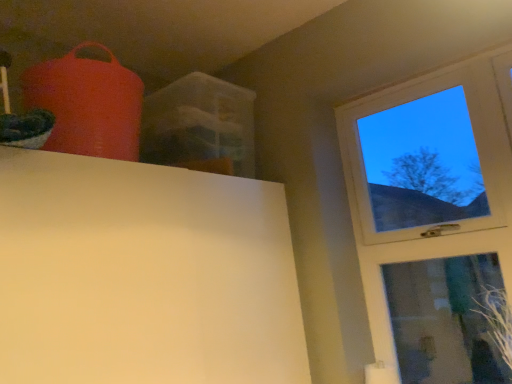
Question: Is transparent glass window at upper right in front of or behind green leafy plant at lower right in the image?

Choices:
 (A) behind
 (B) front

Answer: (A)

Question: From a real-world perspective, is transparent glass window at upper right positioned above or below green leafy plant at lower right?

Choices:
 (A) above
 (B) below

Answer: (A)

Question: In terms of width, does transparent glass window at upper right look wider or thinner when compared to green leafy plant at lower right?

Choices:
 (A) thin
 (B) wide

Answer: (A)

Question: From a real-world perspective, is green leafy plant at lower right physically located above or below transparent glass window at upper right?

Choices:
 (A) below
 (B) above

Answer: (A)

Question: Considering the relative positions of green leafy plant at lower right and transparent glass window at upper right in the image provided, is green leafy plant at lower right to the left or to the right of transparent glass window at upper right?

Choices:
 (A) left
 (B) right

Answer: (B)

Question: Does point (509, 307) appear closer or farther from the camera than point (360, 119)?

Choices:
 (A) farther
 (B) closer

Answer: (B)

Question: Is green leafy plant at lower right inside the boundaries of transparent glass window at upper right, or outside?

Choices:
 (A) inside
 (B) outside

Answer: (B)